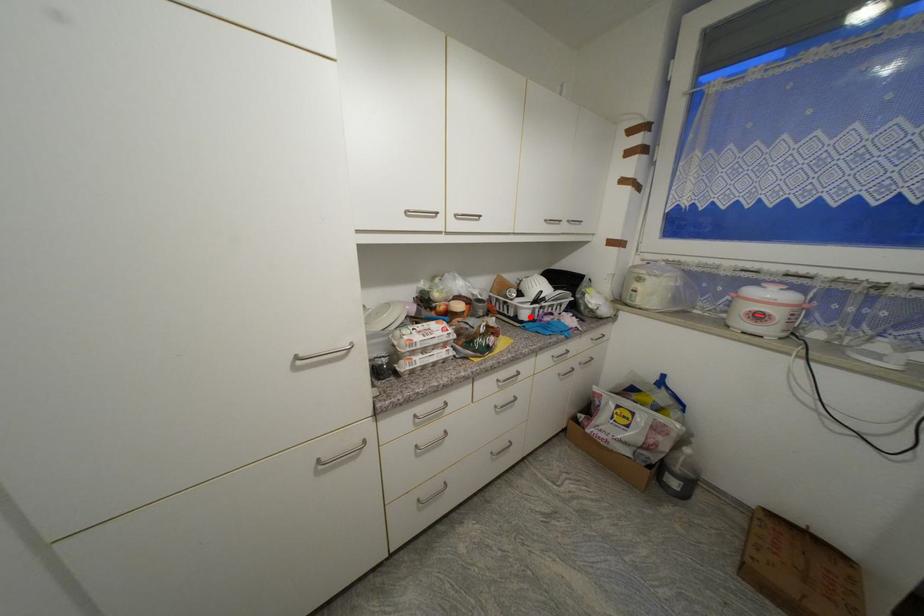
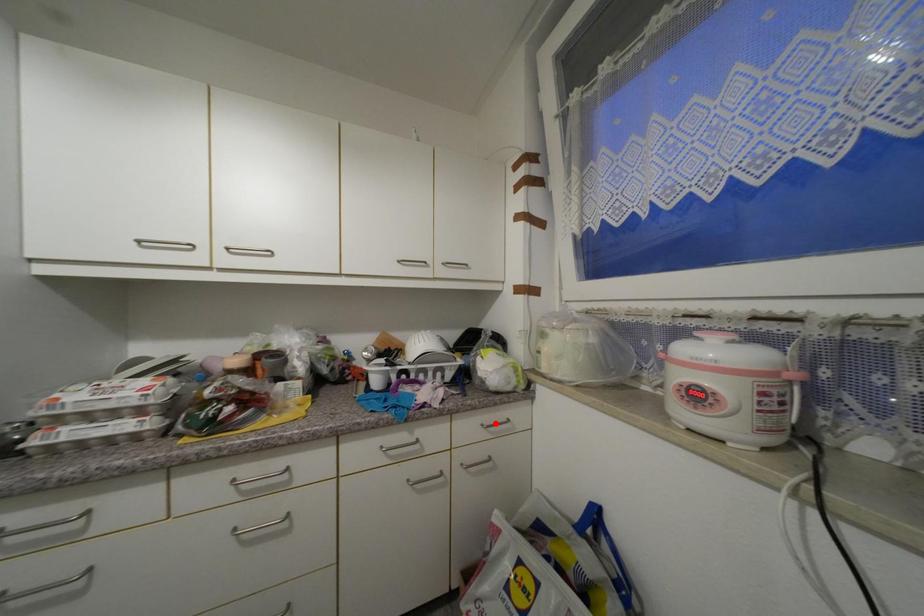
Looking at this image, I am providing you with two images of the same scene from different viewpoints. A red point is marked on the first image and another point is marked on the second image. Is the red point in image1 aligned with the point shown in image2?

No